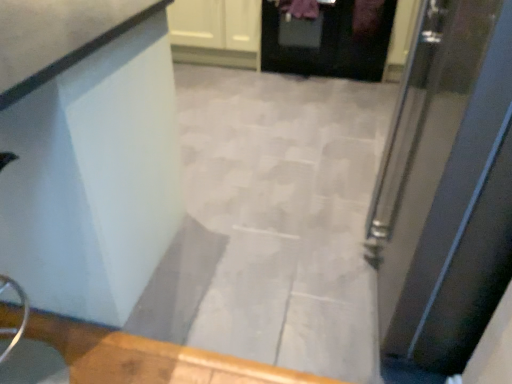
Question: From their relative heights in the image, would you say white glossy cabinet at upper center is taller or shorter than black glossy door at upper center, the 2th door from the bottom?

Choices:
 (A) short
 (B) tall

Answer: (A)

Question: Visually, is white glossy cabinet at upper center positioned to the left or to the right of black glossy door at upper center, acting as the first door starting from the back?

Choices:
 (A) left
 (B) right

Answer: (A)

Question: Estimate the real-world distances between objects in this image. Which object is closer to the black glossy door at upper center, the 2th door from the bottom?

Choices:
 (A) metallic silver door at right, which is the 1th door from front to back
 (B) white glossy cabinet at upper center
 (C) white glossy counter at upper left

Answer: (B)

Question: Which of these objects is positioned farthest from the metallic silver door at right, which is the first door from bottom to top?

Choices:
 (A) black glossy door at upper center, the 2th door from the bottom
 (B) white glossy counter at upper left
 (C) white glossy cabinet at upper center

Answer: (C)